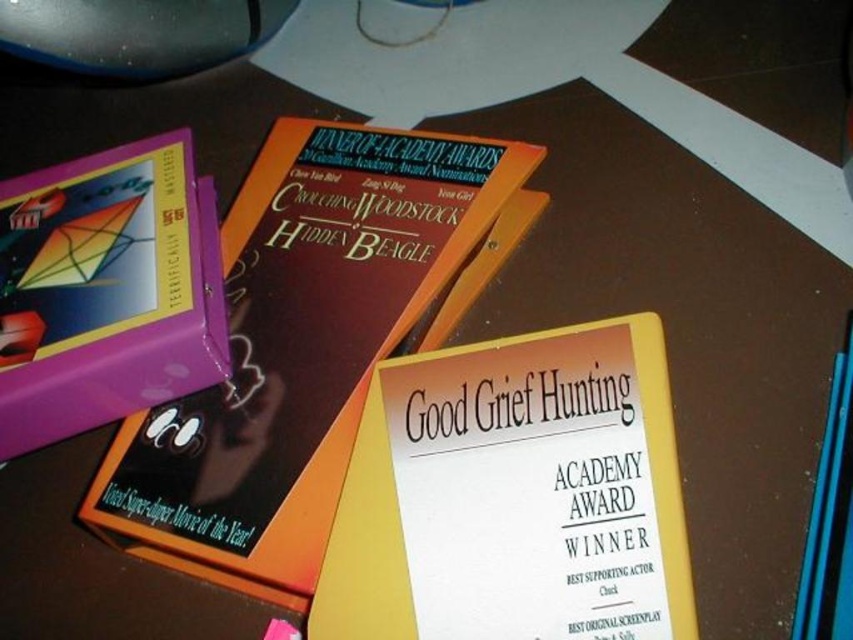
What is the color of the book located at the coordinates point (299, 346)?

The book located at point (299, 346) is matte orange.

You are organizing a document on a dark wooden desk. You have a matte orange book at center and a yellow paper at center. Which item is positioned more to the right?

The yellow paper at center is positioned more to the right than the matte orange book at center.

You are organizing a bookshelf and have a small bookend that is 15 centimeters wide. You want to place it between the matte orange book at center and the purple matte book at left to keep them in place. Will the bookend fit snugly between them without any extra space?

The matte orange book at center is 16.70 centimeters from the purple matte book at left. Since the bookend is 15 centimeters wide, there will be 1.70 centimeters of extra space between them. The bookend will fit but will not be snug as there is some space remaining.